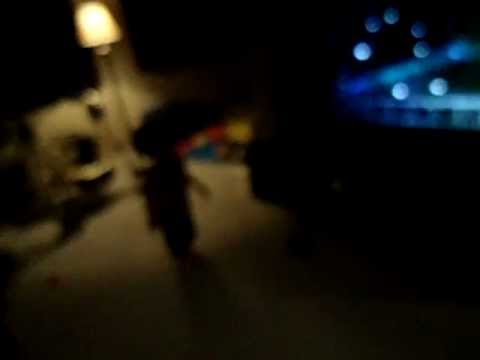
Where is `lampshade`? lampshade is located at coordinates (97, 19).